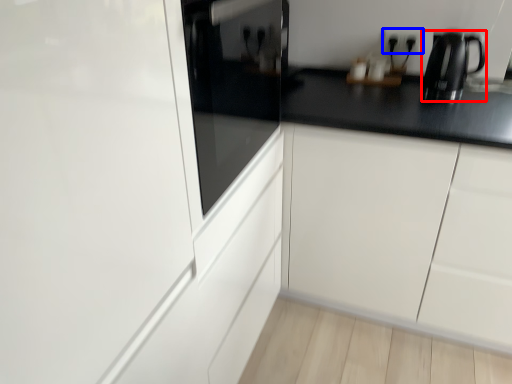
Question: Which object is further to the camera taking this photo, kitchen appliance (highlighted by a red box) or electric outlet (highlighted by a blue box)?

Choices:
 (A) kitchen appliance
 (B) electric outlet

Answer: (B)